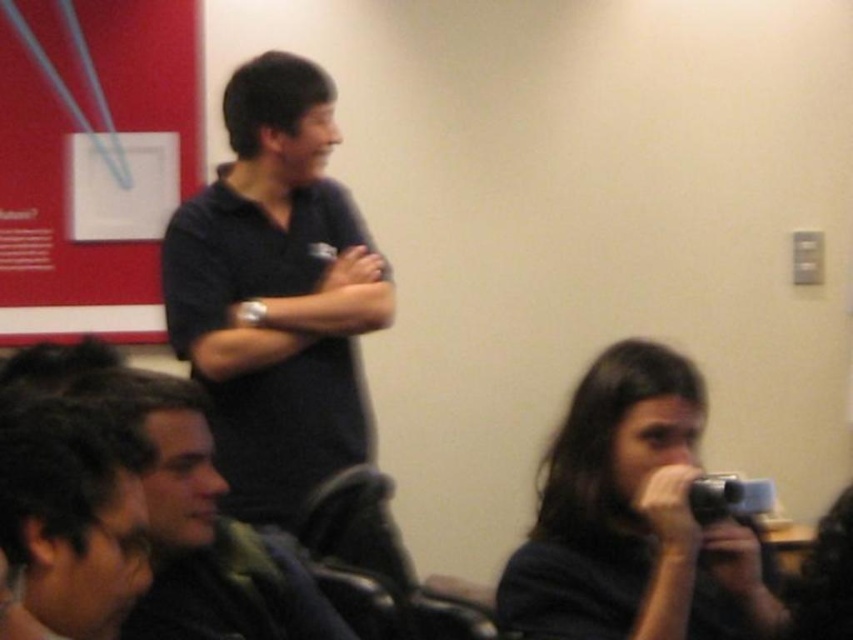
Question: Which object appears farthest from the camera in this image?

Choices:
 (A) dark brown hair at lower left
 (B) dark matte camera at lower right

Answer: (B)

Question: Which object is positioned farthest from the dark brown hair at lower left?

Choices:
 (A) matte black shirt at center
 (B) dark matte camera at lower right
 (C) black matte shirt at center

Answer: (C)

Question: Does dark matte camera at lower right appear under dark brown hair at lower left?

Choices:
 (A) yes
 (B) no

Answer: (A)

Question: Observing the image, what is the correct spatial positioning of matte black shirt at center in reference to dark brown hair at lower left?

Choices:
 (A) below
 (B) above

Answer: (A)

Question: Does black matte shirt at center appear over dark brown hair at lower left?

Choices:
 (A) no
 (B) yes

Answer: (B)

Question: Which of these objects is positioned farthest from the dark matte camera at lower right?

Choices:
 (A) black matte shirt at center
 (B) matte black shirt at center

Answer: (A)